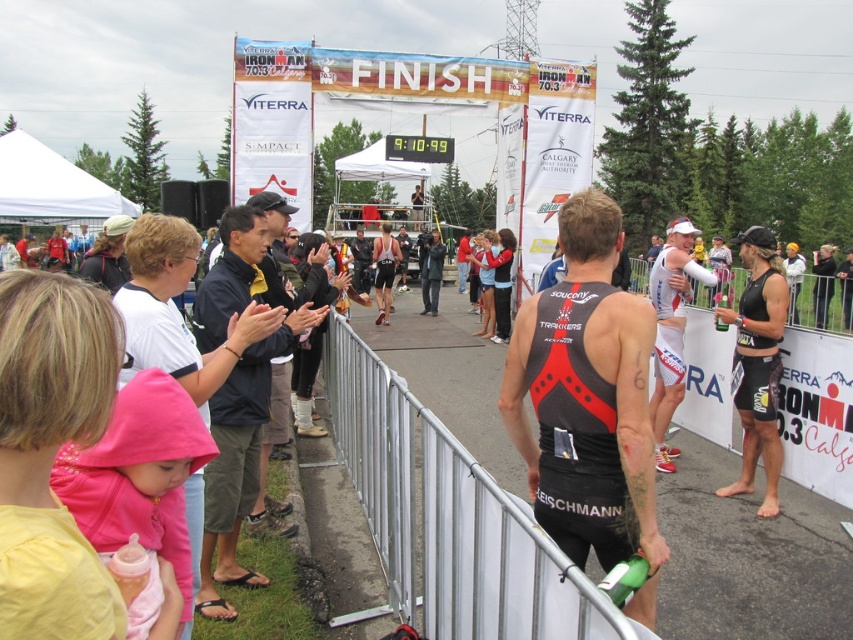
Question: Which of the following is the closest to the observer?

Choices:
 (A) (769, 241)
 (B) (564, 392)

Answer: (B)

Question: Is black matte triathlon suit at center above dark blue jacket at center?

Choices:
 (A) no
 (B) yes

Answer: (A)

Question: Is black matte triathlon suit at center thinner than black matte triathlon suit at right?

Choices:
 (A) no
 (B) yes

Answer: (A)

Question: Based on their relative distances, which object is nearer to the black matte triathlon suit at right?

Choices:
 (A) black spandex tank top at center
 (B) black matte triathlon suit at center
 (C) dark blue jacket at center

Answer: (A)

Question: Is the position of black matte triathlon suit at center less distant than that of black spandex tank top at center?

Choices:
 (A) no
 (B) yes

Answer: (B)

Question: Which of the following is the farthest from the observer?

Choices:
 (A) black matte triathlon suit at center
 (B) black spandex tank top at center
 (C) dark blue jacket at center
 (D) black matte triathlon suit at right

Answer: (D)